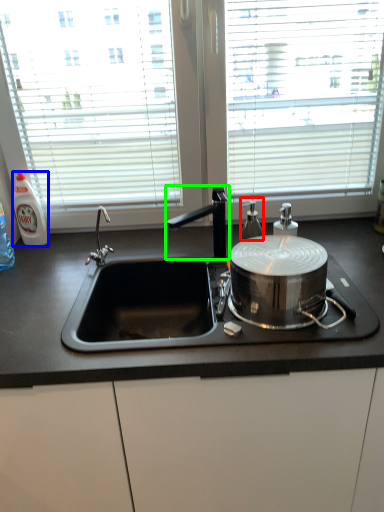
Question: Which is nearer to the bottle (highlighted by a red box)? bottle (highlighted by a blue box) or tap (highlighted by a green box).

Choices:
 (A) bottle
 (B) tap

Answer: (B)